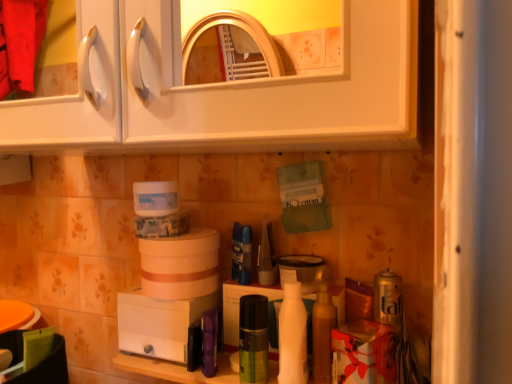
Question: From a real-world perspective, is shiny gold lotion at center, the 2th toiletry viewed from the right, on matte plastic container at center, acting as the third toiletry starting from the left?

Choices:
 (A) no
 (B) yes

Answer: (A)

Question: Is shiny gold lotion at center, the 4th toiletry in the left-to-right sequence, oriented towards matte plastic container at center, positioned as the third toiletry in right-to-left order?

Choices:
 (A) no
 (B) yes

Answer: (A)

Question: Is shiny gold lotion at center, the 4th toiletry in the left-to-right sequence, at the right side of matte plastic container at center, acting as the third toiletry starting from the left?

Choices:
 (A) no
 (B) yes

Answer: (B)

Question: Can you confirm if shiny gold lotion at center, the 4th toiletry in the left-to-right sequence, is taller than matte plastic container at center, acting as the third toiletry starting from the left?

Choices:
 (A) no
 (B) yes

Answer: (B)

Question: Can you confirm if shiny gold lotion at center, the 2th toiletry viewed from the right, is wider than matte plastic container at center, positioned as the third toiletry in right-to-left order?

Choices:
 (A) no
 (B) yes

Answer: (A)

Question: Is point (198, 362) positioned closer to the camera than point (327, 349)?

Choices:
 (A) closer
 (B) farther

Answer: (B)

Question: Choose the correct answer: Is white plastic humidifier at lower center, the first appliance in the left-to-right sequence, inside shiny gold lotion at center, the 2th toiletry viewed from the right, or outside it?

Choices:
 (A) inside
 (B) outside

Answer: (B)

Question: In terms of size, does white plastic humidifier at lower center, the first appliance in the left-to-right sequence, appear bigger or smaller than shiny gold lotion at center, the 4th toiletry in the left-to-right sequence?

Choices:
 (A) small
 (B) big

Answer: (B)

Question: From the image's perspective, is white plastic humidifier at lower center, which is counted as the second appliance, starting from the top, positioned above or below shiny gold lotion at center, the 2th toiletry viewed from the right?

Choices:
 (A) above
 (B) below

Answer: (B)

Question: Considering their positions, is shiny gold lotion at center, the 4th toiletry in the left-to-right sequence, located in front of or behind matte plastic container at center, acting as the third toiletry starting from the left?

Choices:
 (A) front
 (B) behind

Answer: (A)

Question: Considering the positions of shiny gold lotion at center, the 2th toiletry viewed from the right, and matte plastic container at center, positioned as the third toiletry in right-to-left order, in the image, is shiny gold lotion at center, the 2th toiletry viewed from the right, taller or shorter than matte plastic container at center, positioned as the third toiletry in right-to-left order,?

Choices:
 (A) tall
 (B) short

Answer: (A)

Question: Considering the relative positions of shiny gold lotion at center, the 2th toiletry viewed from the right, and matte plastic container at center, positioned as the third toiletry in right-to-left order, in the image provided, is shiny gold lotion at center, the 2th toiletry viewed from the right, to the left or to the right of matte plastic container at center, positioned as the third toiletry in right-to-left order,?

Choices:
 (A) right
 (B) left

Answer: (A)

Question: Considering the positions of shiny gold lotion at center, the 2th toiletry viewed from the right, and matte plastic container at center, acting as the third toiletry starting from the left, in the image, is shiny gold lotion at center, the 2th toiletry viewed from the right, wider or thinner than matte plastic container at center, acting as the third toiletry starting from the left,?

Choices:
 (A) wide
 (B) thin

Answer: (B)

Question: In terms of size, does white plastic humidifier at lower center, the 2th appliance when ordered from right to left, appear bigger or smaller than white glossy bottle at center?

Choices:
 (A) big
 (B) small

Answer: (A)

Question: Considering the positions of white plastic humidifier at lower center, the first appliance in the left-to-right sequence, and white glossy bottle at center in the image, is white plastic humidifier at lower center, the first appliance in the left-to-right sequence, wider or thinner than white glossy bottle at center?

Choices:
 (A) thin
 (B) wide

Answer: (B)